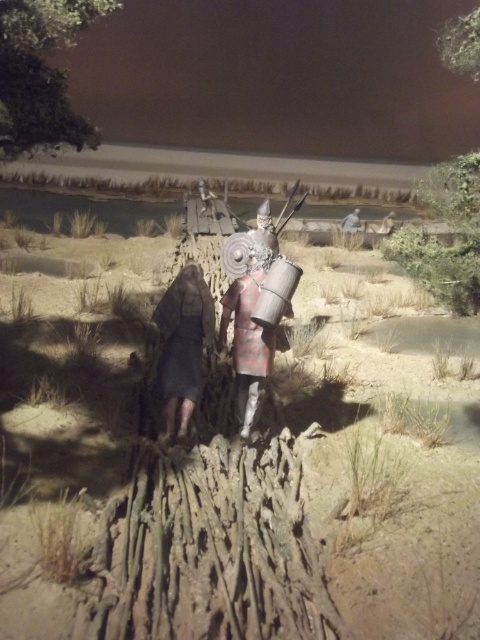
Question: Which object appears farthest from the camera in this image?

Choices:
 (A) dark gray fabric dress at center
 (B) shiny silver armor at center

Answer: (B)

Question: Is the position of green leafy tree at upper left more distant than that of shiny silver armor at center?

Choices:
 (A) yes
 (B) no

Answer: (B)

Question: Which point is closer to the camera taking this photo?

Choices:
 (A) (435, 244)
 (B) (52, 48)

Answer: (B)

Question: Does green leafy tree at upper right appear on the right side of dark gray fabric dress at center?

Choices:
 (A) yes
 (B) no

Answer: (A)

Question: Which object appears farthest from the camera in this image?

Choices:
 (A) shiny silver armor at center
 (B) dark gray fabric dress at center
 (C) green leafy tree at upper left

Answer: (A)

Question: Is green leafy tree at upper left to the left of shiny silver armor at center from the viewer's perspective?

Choices:
 (A) no
 (B) yes

Answer: (B)